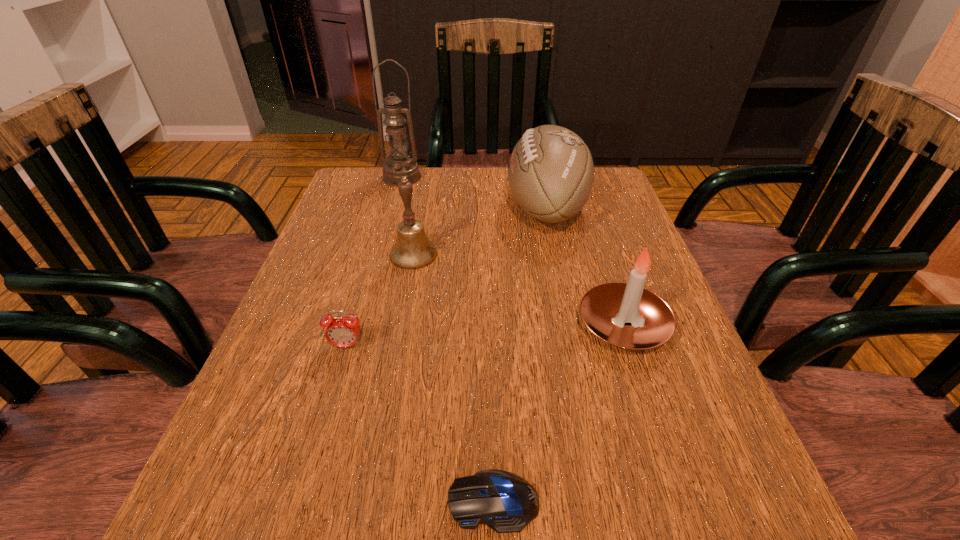
You are a GUI agent. You are given a task and a screenshot of the screen. Output one action in this format:
    pyautogui.click(x=<x>, y=<y>)
    Task: Click on the vacant region at the far right corner of the desktop
    The width and height of the screenshot is (960, 540).
    Given the screenshot: What is the action you would take?
    pyautogui.click(x=620, y=210)

What are the coordinates of `vacant space that is in between the candle and the tallest object` in the screenshot? It's located at (513, 251).

Where is `free space that is in between the fifth tallest object and the oil lamp`? free space that is in between the fifth tallest object and the oil lamp is located at coordinates (374, 261).

At what (x,y) coordinates should I click in order to perform the action: click on free space between the tallest object and the candle. Please return your answer as a coordinate pair (x, y). Looking at the image, I should click on (513, 251).

Image resolution: width=960 pixels, height=540 pixels. I want to click on free space between the football (American) and the second shortest object, so pyautogui.click(x=446, y=277).

At what (x,y) coordinates should I click in order to perform the action: click on vacant region between the football (American) and the second shortest object. Please return your answer as a coordinate pair (x, y). This screenshot has height=540, width=960. Looking at the image, I should click on (446, 277).

Identify the location of free space between the candle and the football (American). (585, 267).

At what (x,y) coordinates should I click in order to perform the action: click on empty space that is in between the football (American) and the shortest object. Please return your answer as a coordinate pair (x, y). This screenshot has height=540, width=960. Looking at the image, I should click on (519, 354).

Identify the location of blank region between the candle and the bell. (518, 290).

Find the location of a particular element. empty space between the alarm clock and the bell is located at coordinates (380, 300).